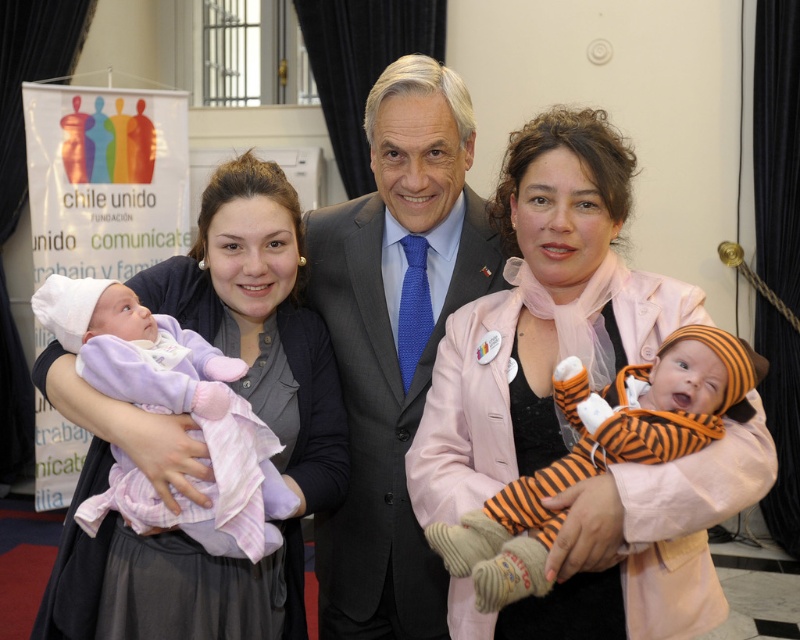
Question: In this image, where is matte black suit at center located relative to matte purple blanket at left?

Choices:
 (A) below
 (B) above

Answer: (B)

Question: Which of the following is the closest to the observer?

Choices:
 (A) matte purple blanket at left
 (B) orange striped onesie at center

Answer: (B)

Question: Can you confirm if matte black suit at center is thinner than orange striped onesie at center?

Choices:
 (A) no
 (B) yes

Answer: (B)

Question: Which object is farther from the camera taking this photo?

Choices:
 (A) orange striped onesie at center
 (B) matte purple blanket at left

Answer: (B)

Question: Which is nearer to the matte black suit at center?

Choices:
 (A) matte gray blazer at center
 (B) matte purple blanket at left
 (C) orange striped onesie at center

Answer: (A)

Question: Can you confirm if matte gray blazer at center is bigger than orange striped onesie at center?

Choices:
 (A) no
 (B) yes

Answer: (B)